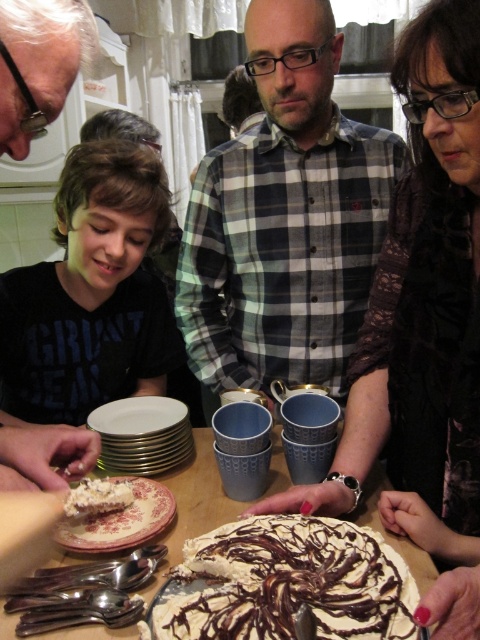
Question: Which of the following is the closest to the observer?

Choices:
 (A) (10, 440)
 (B) (68, 545)

Answer: (B)

Question: Does plaid shirt at center have a greater width compared to white creamy frosting at lower left?

Choices:
 (A) yes
 (B) no

Answer: (A)

Question: Estimate the real-world distances between objects in this image. Which object is farther from the floral ceramic plate at lower left?

Choices:
 (A) chocolate frosted cake at center
 (B) plaid shirt at center

Answer: (B)

Question: Among these objects, which one is nearest to the camera?

Choices:
 (A) chocolate frosted cake at center
 (B) plaid shirt at center

Answer: (A)

Question: Is plaid shirt at center to the right of matte black shirt at center from the viewer's perspective?

Choices:
 (A) no
 (B) yes

Answer: (B)

Question: Does white ceramic table at center have a smaller size compared to floral ceramic plate at lower left?

Choices:
 (A) no
 (B) yes

Answer: (A)